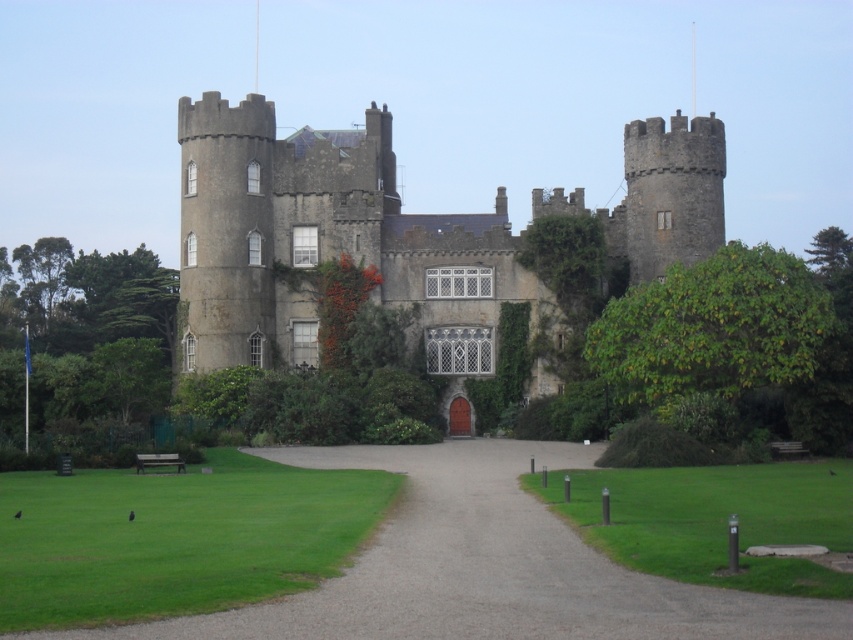
Question: Is gray stone castle at center below gray gravel driveway at center?

Choices:
 (A) no
 (B) yes

Answer: (A)

Question: Which point appears closest to the camera in this image?

Choices:
 (A) (650, 244)
 (B) (573, 461)

Answer: (B)

Question: In this image, where is gray stone castle at center located relative to gray gravel driveway at center?

Choices:
 (A) below
 (B) above

Answer: (B)

Question: Is gray stone castle at center thinner than gray gravel driveway at center?

Choices:
 (A) no
 (B) yes

Answer: (A)

Question: Which point is closer to the camera taking this photo?

Choices:
 (A) (692, 125)
 (B) (582, 541)

Answer: (B)